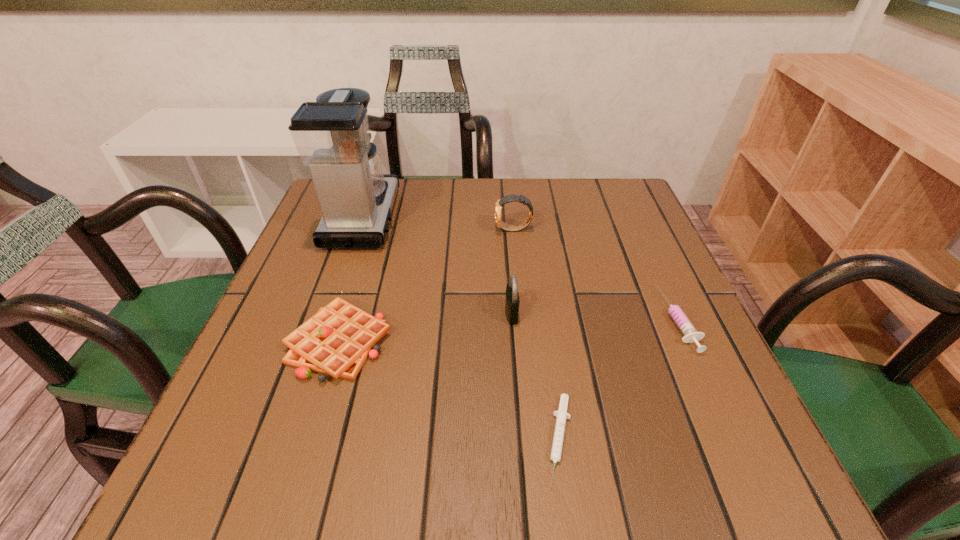
This screenshot has height=540, width=960. What are the coordinates of `coffee maker` in the screenshot? It's located at (331, 135).

You are a GUI agent. You are given a task and a screenshot of the screen. Output one action in this format:
    pyautogui.click(x=<x>, y=<y>)
    Task: Click on the padlock
    The width and height of the screenshot is (960, 540).
    Given the screenshot: What is the action you would take?
    pyautogui.click(x=512, y=301)

At what (x,y) coordinates should I click in order to perform the action: click on watch. Please return your answer as a coordinate pair (x, y). This screenshot has height=540, width=960. Looking at the image, I should click on (502, 225).

Where is `the third shortest object`? the third shortest object is located at coordinates (337, 340).

Locate an element on the screen. This screenshot has width=960, height=540. the right syringe is located at coordinates (x=686, y=327).

At what (x,y) coordinates should I click in order to perform the action: click on the second shortest object. Please return your answer as a coordinate pair (x, y). This screenshot has width=960, height=540. Looking at the image, I should click on (686, 327).

This screenshot has width=960, height=540. Identify the location of the shorter syringe. (561, 414).

Where is `the shortest object`? The image size is (960, 540). the shortest object is located at coordinates (561, 414).

Image resolution: width=960 pixels, height=540 pixels. I want to click on free space located 0.180m at the front of the coffee maker where the controls are located, so click(x=468, y=218).

Where is `free space located on the front of the padlock`? Image resolution: width=960 pixels, height=540 pixels. free space located on the front of the padlock is located at coordinates (516, 364).